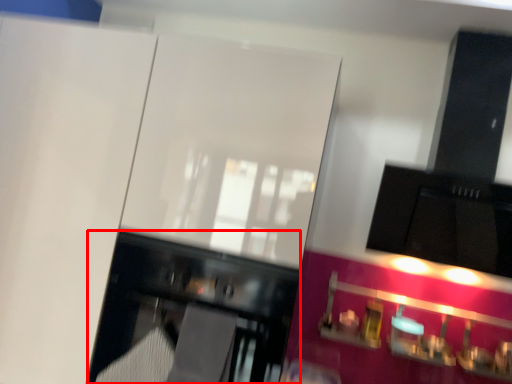
Question: Considering the relative positions of furniture (annotated by the red box) and cabinetry in the image provided, where is furniture (annotated by the red box) located with respect to the staircase?

Choices:
 (A) left
 (B) right

Answer: (A)